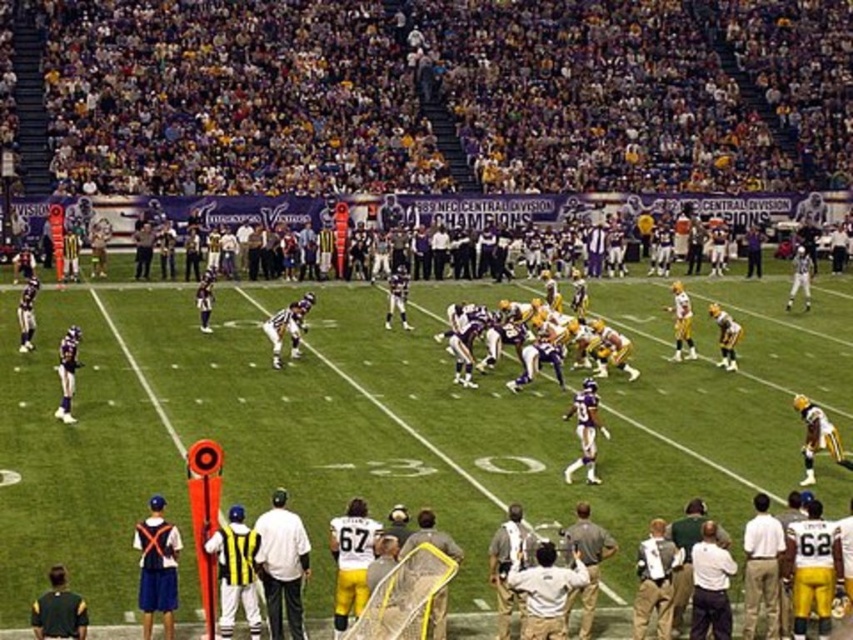
You are a photographer standing at the edge of the field, and you want to take a photo that includes both the dark purple jersey at upper center and the white matte shirt at center. Which one should you focus on first to ensure both are in frame?

You should focus on the dark purple jersey at upper center first since it is closer to you than the white matte shirt at center, ensuring both are in frame by adjusting the camera angle accordingly.

You are a photographer at the stadium and want to capture both the dark purple jersey at upper center and the white matte shirt at center in a single shot. Given their sizes, which object would require you to adjust your camera to a wider angle to ensure both fit in the frame?

The dark purple jersey at upper center has a greater width than the white matte shirt at center, so you would need to adjust your camera to a wider angle to accommodate its larger size while including both in the frame.